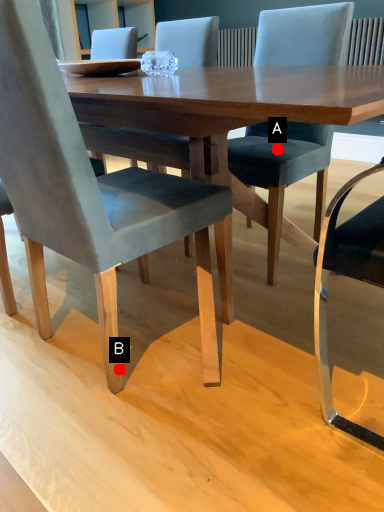
Question: Two points are circled on the image, labeled by A and B beside each circle. Which of the following is the closest to the observer?

Choices:
 (A) A is closer
 (B) B is closer

Answer: (B)